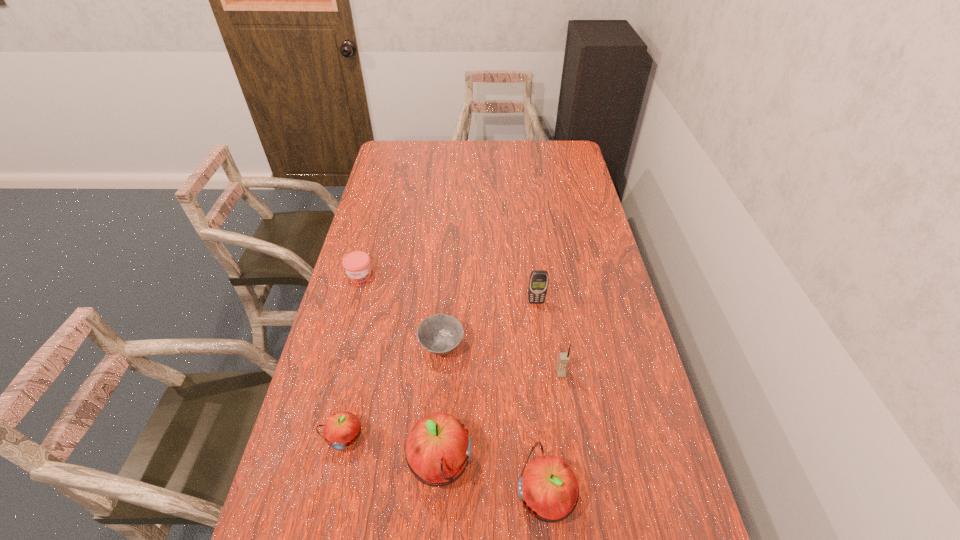
The image size is (960, 540). I want to click on the third shortest object, so click(x=341, y=430).

The height and width of the screenshot is (540, 960). In order to click on the shortest apple in this screenshot , I will do [x=341, y=430].

The width and height of the screenshot is (960, 540). I want to click on the second apple from left to right, so click(438, 449).

The width and height of the screenshot is (960, 540). What are the coordinates of `the second shortest apple` in the screenshot? It's located at (547, 486).

Where is `the right cellular telephone`? This screenshot has width=960, height=540. the right cellular telephone is located at coordinates (563, 359).

Locate an element on the screen. The height and width of the screenshot is (540, 960). the nearer cellular telephone is located at coordinates (563, 359).

The width and height of the screenshot is (960, 540). I want to click on jam, so click(x=357, y=264).

You are a GUI agent. You are given a task and a screenshot of the screen. Output one action in this format:
    pyautogui.click(x=<x>, y=<y>)
    Task: Click on the bowl
    Image resolution: width=960 pixels, height=540 pixels.
    Given the screenshot: What is the action you would take?
    pyautogui.click(x=440, y=334)

Identify the location of the second farthest object. (538, 282).

Where is `the farther cellular telephone`? The width and height of the screenshot is (960, 540). the farther cellular telephone is located at coordinates (538, 282).